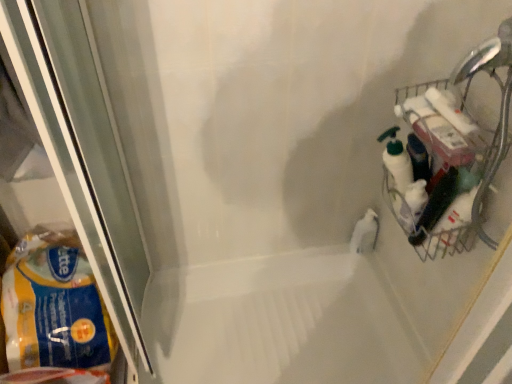
Question: Is white glossy bottle at center situated inside metallic wire basket at right or outside?

Choices:
 (A) inside
 (B) outside

Answer: (B)

Question: In terms of width, does white glossy bottle at center look wider or thinner when compared to metallic wire basket at right?

Choices:
 (A) thin
 (B) wide

Answer: (A)

Question: Based on their relative distances, which object is farther from the metallic wire basket at right?

Choices:
 (A) white glossy bath at center
 (B) white glossy bottle at center
 (C) yellow plastic bag at left

Answer: (C)

Question: Estimate the real-world distances between objects in this image. Which object is farther from the white glossy bath at center?

Choices:
 (A) metallic wire basket at right
 (B) yellow plastic bag at left
 (C) white glossy bottle at center

Answer: (A)